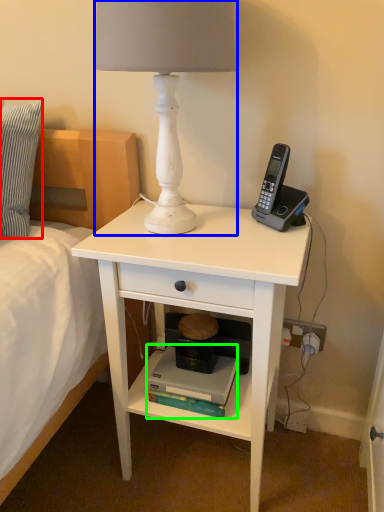
Question: Estimate the real-world distances between objects in this image. Which object is farther from pillow (highlighted by a red box), lamp (highlighted by a blue box) or book (highlighted by a green box)?

Choices:
 (A) lamp
 (B) book

Answer: (B)